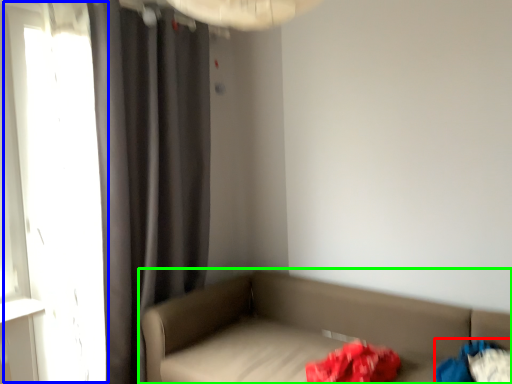
Question: Based on their relative distances, which object is farther from clothing (highlighted by a red box)? Choose from window (highlighted by a blue box) and studio couch (highlighted by a green box).

Choices:
 (A) window
 (B) studio couch

Answer: (A)